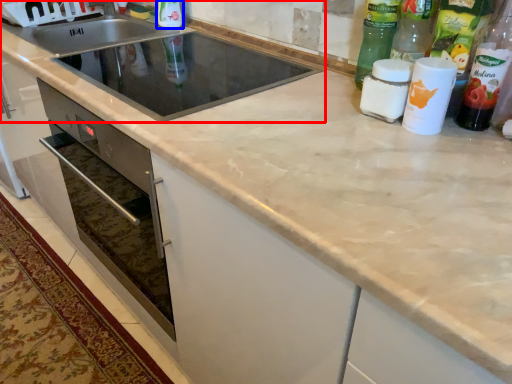
Question: Which point is further to the camera, sink (highlighted by a red box) or bottle (highlighted by a blue box)?

Choices:
 (A) sink
 (B) bottle

Answer: (B)